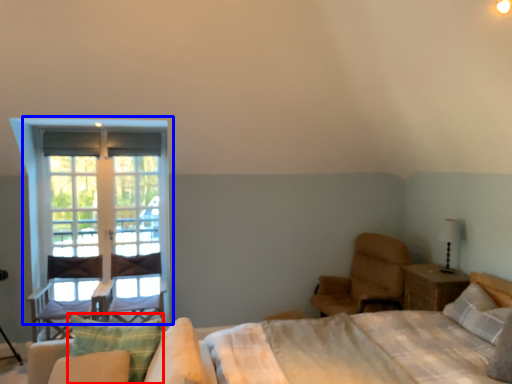
Question: Among these objects, which one is farthest to the camera, pillow (highlighted by a red box) or window (highlighted by a blue box)?

Choices:
 (A) pillow
 (B) window

Answer: (B)